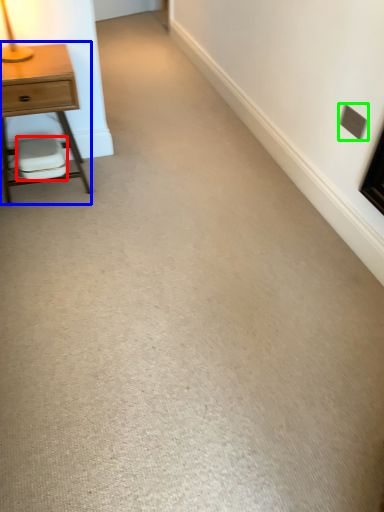
Question: Which object is positioned farthest from swivel chair (highlighted by a red box)? Select from nightstand (highlighted by a blue box) and electric outlet (highlighted by a green box).

Choices:
 (A) nightstand
 (B) electric outlet

Answer: (B)